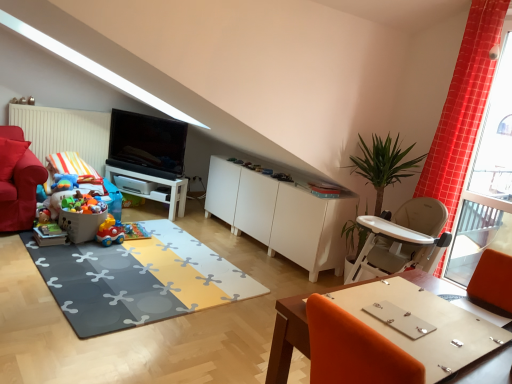
You are a GUI agent. You are given a task and a screenshot of the screen. Output one action in this format:
    pyautogui.click(x=<x>, y=<y>)
    Task: Click on the vacant area that is situated to the right of matte plastic toy at lower left, acting as the fourth toy starting from the top
    The width and height of the screenshot is (512, 384).
    Given the screenshot: What is the action you would take?
    pyautogui.click(x=73, y=244)